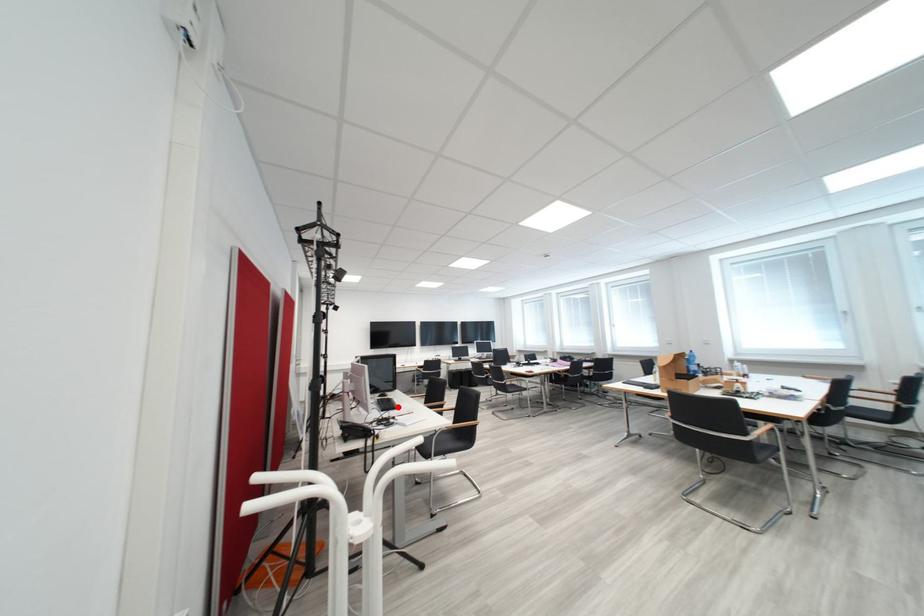
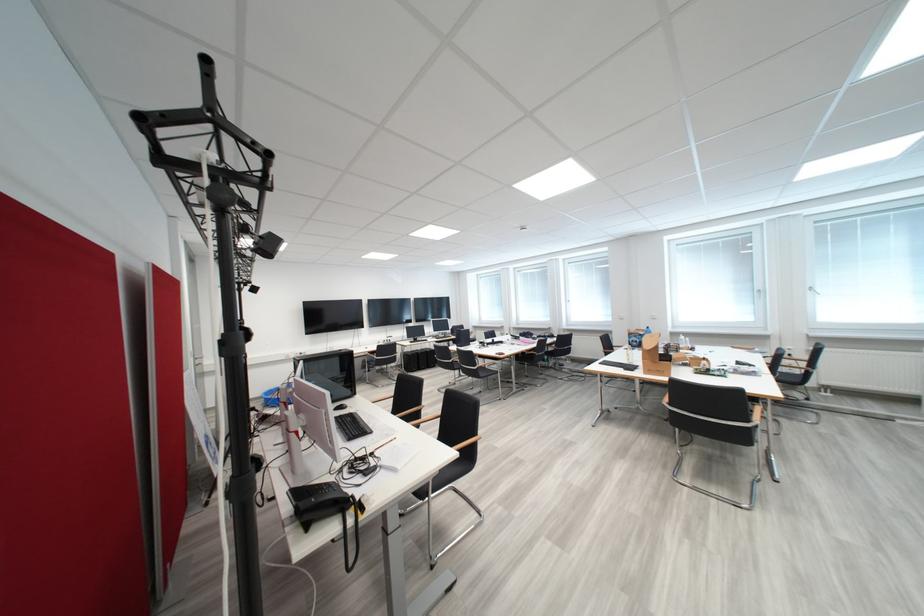
Question: I am providing you with two images of the same scene from different viewpoints. A red point is marked on the first image. Is the red point's position out of view in image 2?

Choices:
 (A) Yes
 (B) No

Answer: (B)